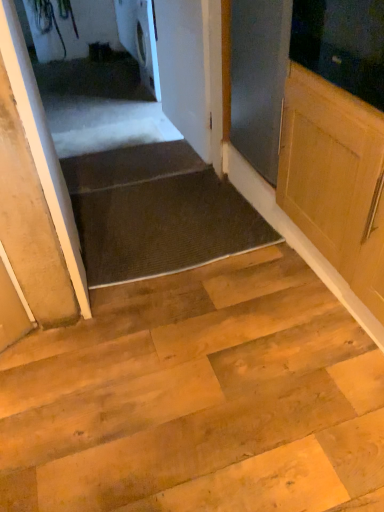
Question: Is dark gray textured mat at center taller than white glossy washing machine at upper center?

Choices:
 (A) yes
 (B) no

Answer: (B)

Question: From a real-world perspective, is dark gray textured mat at center positioned under white glossy washing machine at upper center based on gravity?

Choices:
 (A) no
 (B) yes

Answer: (B)

Question: Is dark gray textured mat at center with white glossy washing machine at upper center?

Choices:
 (A) yes
 (B) no

Answer: (B)

Question: From a real-world perspective, is dark gray textured mat at center on white glossy washing machine at upper center?

Choices:
 (A) yes
 (B) no

Answer: (B)

Question: From the image's perspective, does dark gray textured mat at center appear higher than white glossy washing machine at upper center?

Choices:
 (A) no
 (B) yes

Answer: (A)

Question: From the image's perspective, is white matte door at left, positioned as the second door in back-to-front order, positioned above or below dark brown carpet at lower center?

Choices:
 (A) above
 (B) below

Answer: (B)

Question: In the image, is white matte door at left, positioned as the second door in back-to-front order, on the left side or the right side of dark brown carpet at lower center?

Choices:
 (A) left
 (B) right

Answer: (A)

Question: From a real-world perspective, is white matte door at left, the 2th door positioned from the right, physically located above or below dark brown carpet at lower center?

Choices:
 (A) below
 (B) above

Answer: (B)

Question: In terms of width, does white matte door at left, which is the 1th door in left-to-right order, look wider or thinner when compared to dark brown carpet at lower center?

Choices:
 (A) thin
 (B) wide

Answer: (B)

Question: Is white matte door at left, positioned as the second door in back-to-front order, taller or shorter than white glossy washing machine at upper center?

Choices:
 (A) tall
 (B) short

Answer: (A)

Question: Considering the positions of white matte door at left, which is the 1th door in left-to-right order, and white glossy washing machine at upper center in the image, is white matte door at left, which is the 1th door in left-to-right order, bigger or smaller than white glossy washing machine at upper center?

Choices:
 (A) big
 (B) small

Answer: (B)

Question: Looking at their shapes, would you say white matte door at left, the 2th door positioned from the right, is wider or thinner than white glossy washing machine at upper center?

Choices:
 (A) thin
 (B) wide

Answer: (B)

Question: Would you say white matte door at left, positioned as the second door in back-to-front order, is inside or outside white glossy washing machine at upper center?

Choices:
 (A) inside
 (B) outside

Answer: (B)

Question: In the image, is dark gray textured mat at center positioned in front of or behind white matte door at upper center, the first door positioned from the back?

Choices:
 (A) behind
 (B) front

Answer: (B)

Question: Is point (167, 250) closer or farther from the camera than point (203, 88)?

Choices:
 (A) farther
 (B) closer

Answer: (B)